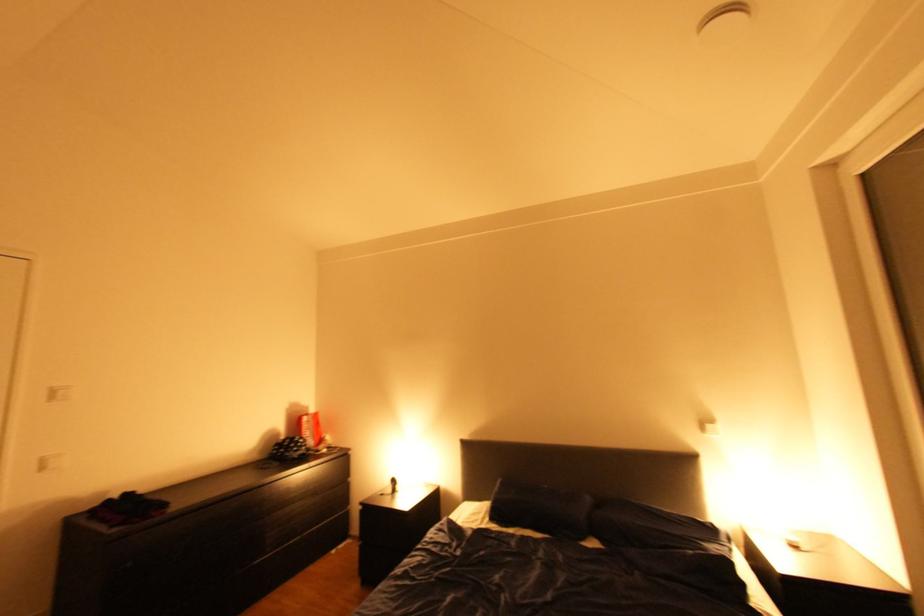
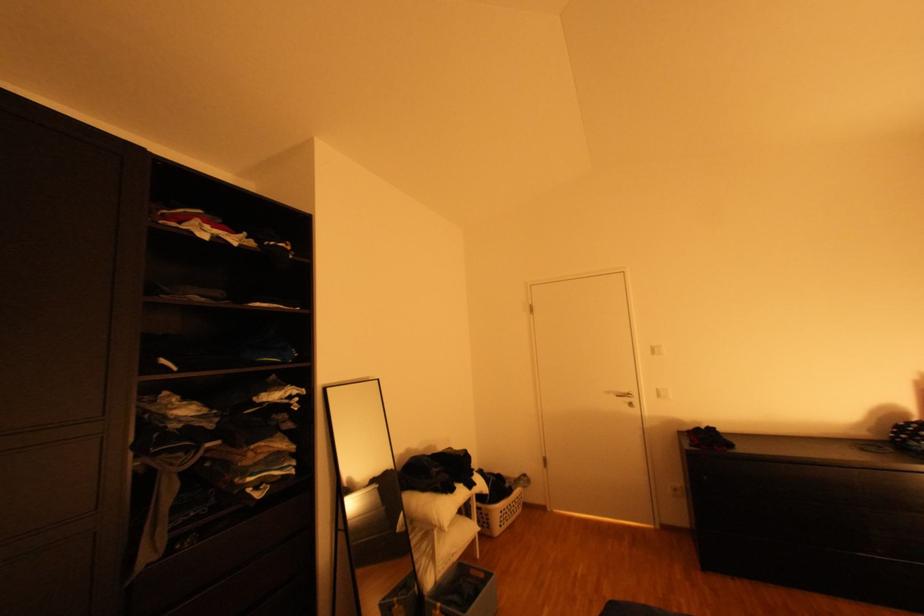
Find the pixel in the second image that matches (65,392) in the first image.

(662, 349)